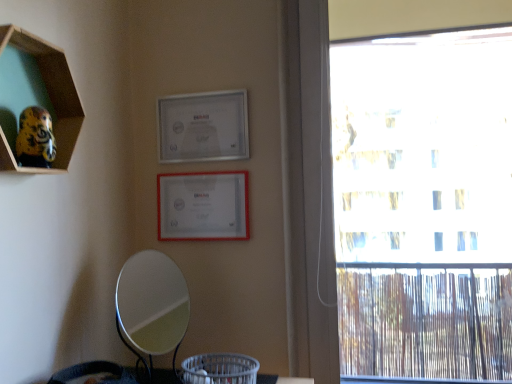
Question: From their relative heights in the image, would you say silver metallic picture frame at upper center, which is the first picture frame from top to bottom, is taller or shorter than silver/metallic mirror at lower center?

Choices:
 (A) tall
 (B) short

Answer: (B)

Question: Looking at their shapes, would you say silver metallic picture frame at upper center, the second picture frame positioned from the bottom, is wider or thinner than silver/metallic mirror at lower center?

Choices:
 (A) wide
 (B) thin

Answer: (B)

Question: Which is nearer to the silver/metallic mirror at lower center?

Choices:
 (A) transparent glass window at right
 (B) wooden hexagon at upper left
 (C) white matte picture frame at upper center, which is counted as the first picture frame, starting from the bottom
 (D) silver metallic picture frame at upper center, the second picture frame positioned from the bottom
 (E) gray woven basket at lower center

Answer: (E)

Question: Which object is positioned closest to the gray woven basket at lower center?

Choices:
 (A) silver/metallic mirror at lower center
 (B) wooden hexagon at upper left
 (C) white matte picture frame at upper center, marked as the 2th picture frame in a top-to-bottom arrangement
 (D) silver metallic picture frame at upper center, which is the first picture frame from top to bottom
 (E) transparent glass window at right

Answer: (A)